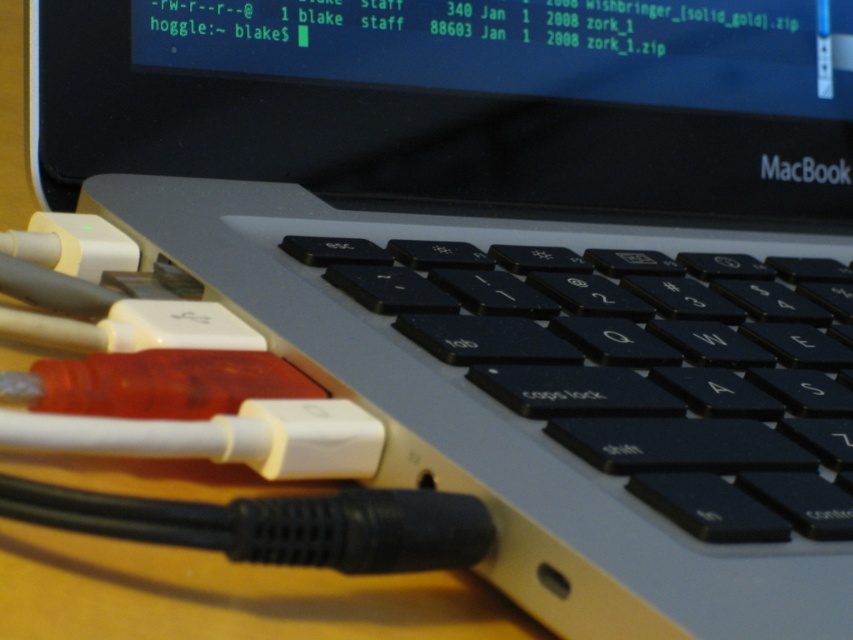
Does black glossy screen at upper center have a greater height compared to black matte keyboard at center?

Yes.

This screenshot has width=853, height=640. What do you see at coordinates (462, 104) in the screenshot?
I see `black glossy screen at upper center` at bounding box center [462, 104].

Does point (618, 120) come behind point (706, 369)?

Yes, point (618, 120) is farther from viewer.

Where is `black glossy screen at upper center`? black glossy screen at upper center is located at coordinates (462, 104).